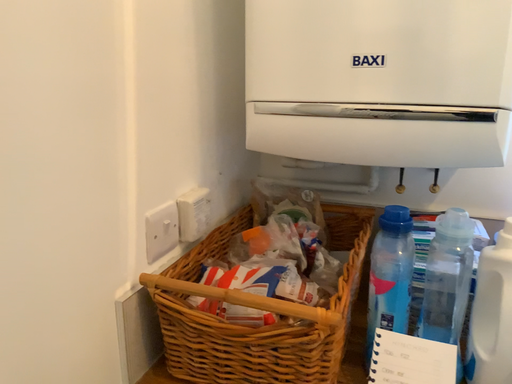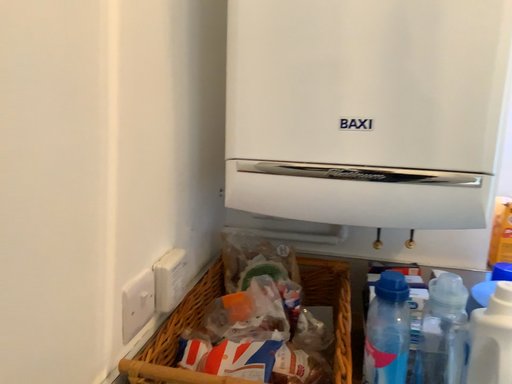
Question: Which way did the camera rotate in the video?

Choices:
 (A) rotated right
 (B) rotated left

Answer: (A)